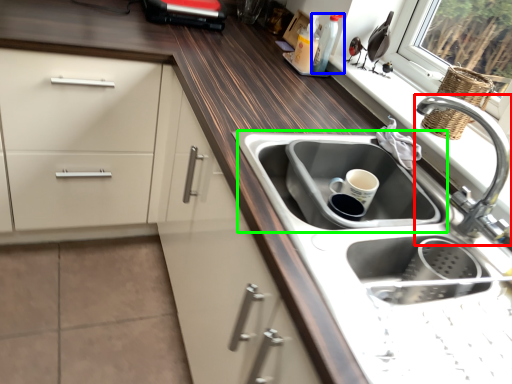
Question: Based on their relative distances, which object is nearer to tap (highlighted by a red box)? Choose from bottle (highlighted by a blue box) and sink (highlighted by a green box).

Choices:
 (A) bottle
 (B) sink

Answer: (B)